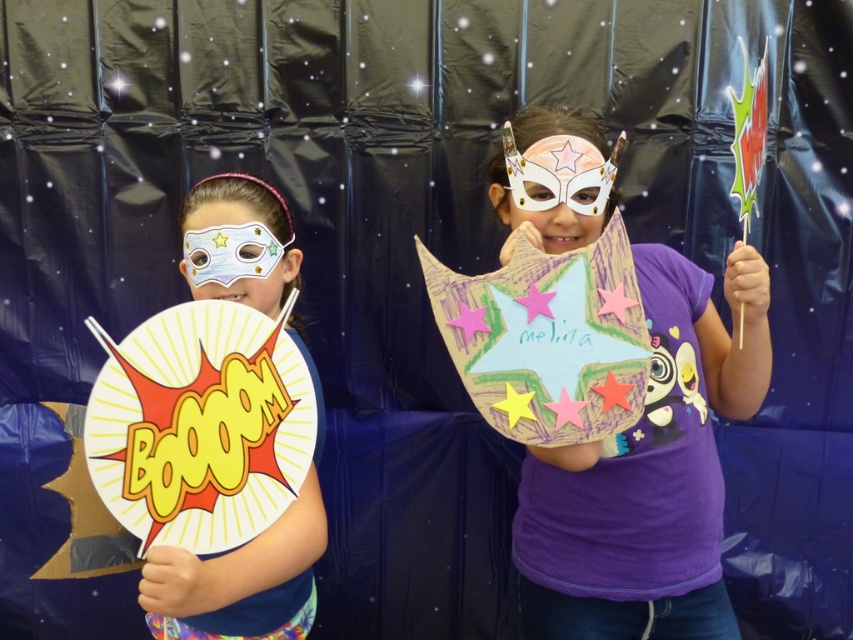
You are standing in front of the backdrop and want to place a yellow paper plate at left on a shelf that is 36 inches away from you. Can you reach the shelf without moving your position?

The yellow paper plate at left is 38.78 inches away from the viewer. Since the shelf is 36 inches away, you can reach it without moving because the shelf is closer than the plate.

You are a photographer setting up for a photoshoot with two children. The scene has a dark blue backdrop with star specks. The child on the left holds a circular explosion sign, and there is a point marked at coordinates (247, 566). What object is located at that point?

The point at (247, 566) marks the matte paper mask at left.

You are a photographer setting up for a photo shoot with two children. The scene has a dark blue backdrop with stars. You notice the yellow paper plate at left and the matte white mask at left. From your position, which object is closer to you?

The yellow paper plate at left is closer to you because it is in front of the matte white mask at left.